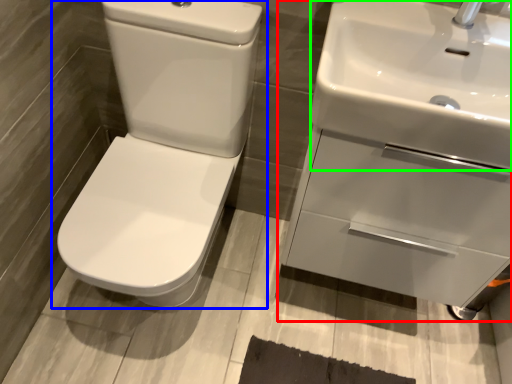
Question: Estimate the real-world distances between objects in this image. Which object is farther from sink (highlighted by a red box), toilet (highlighted by a blue box) or sink (highlighted by a green box)?

Choices:
 (A) toilet
 (B) sink

Answer: (A)